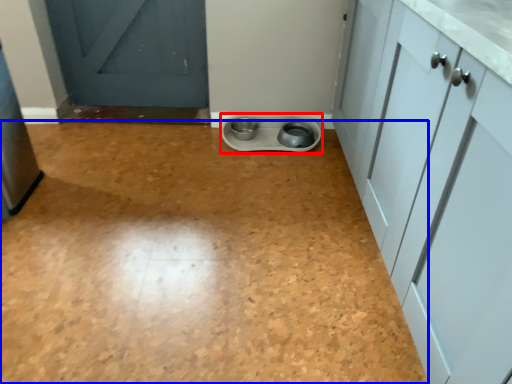
Question: Which of the following is the closest to the observer, appliance (highlighted by a red box) or plain (highlighted by a blue box)?

Choices:
 (A) appliance
 (B) plain

Answer: (B)